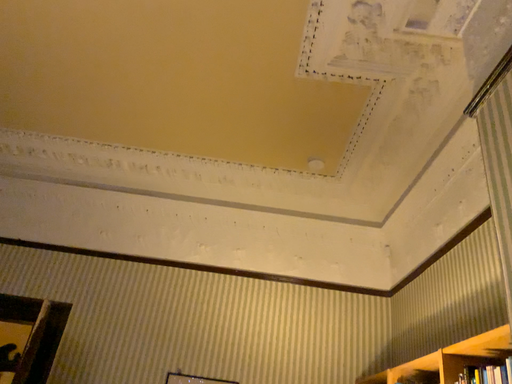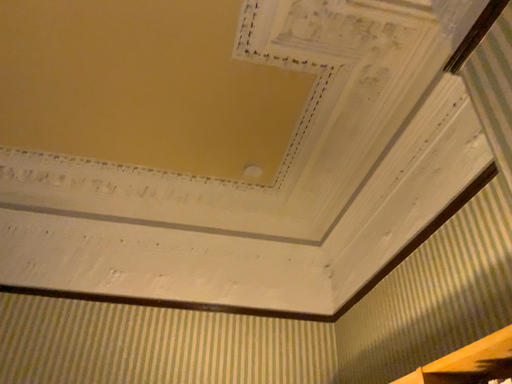
Question: How did the camera likely rotate when shooting the video?

Choices:
 (A) rotated left
 (B) rotated right

Answer: (B)